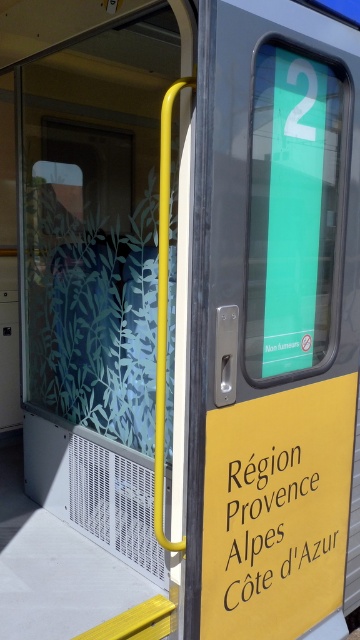
Question: Does yellow matte signboard at center have a greater width compared to yellow matte sign at center?

Choices:
 (A) yes
 (B) no

Answer: (A)

Question: Can you confirm if yellow matte signboard at center is positioned to the right of yellow matte sign at center?

Choices:
 (A) yes
 (B) no

Answer: (B)

Question: Does yellow matte signboard at center have a greater width compared to yellow matte sign at center?

Choices:
 (A) no
 (B) yes

Answer: (B)

Question: Which of the following is the closest to the observer?

Choices:
 (A) yellow matte sign at center
 (B) yellow matte signboard at center

Answer: (B)

Question: Which object is closer to the camera taking this photo?

Choices:
 (A) yellow matte sign at center
 (B) yellow matte signboard at center

Answer: (B)